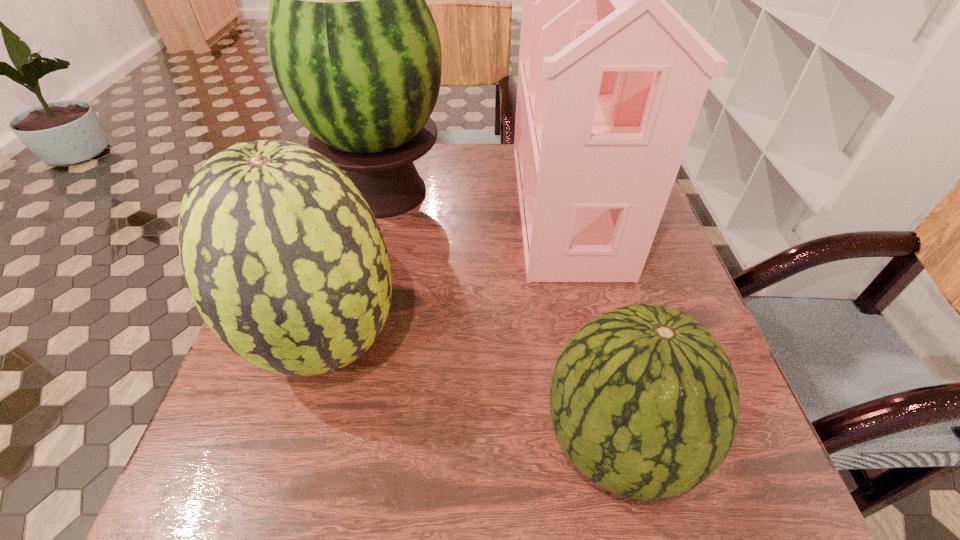
This screenshot has width=960, height=540. I want to click on vacant space located 0.160m on the left of the rightmost watermelon, so click(436, 442).

Where is `dollhouse that is at the far edge`? This screenshot has width=960, height=540. dollhouse that is at the far edge is located at coordinates (609, 90).

This screenshot has height=540, width=960. I want to click on watermelon at the far edge, so click(x=353, y=46).

Image resolution: width=960 pixels, height=540 pixels. Find the location of `object at the near edge`. object at the near edge is located at coordinates click(x=644, y=401).

Where is `dollhouse present at the right edge`? dollhouse present at the right edge is located at coordinates (609, 90).

Find the location of a particular element. The width and height of the screenshot is (960, 540). watermelon that is at the right edge is located at coordinates (644, 401).

Where is `object present at the far left corner`? This screenshot has height=540, width=960. object present at the far left corner is located at coordinates (353, 46).

Where is `object located in the far right corner section of the desktop`? This screenshot has width=960, height=540. object located in the far right corner section of the desktop is located at coordinates (609, 90).

Identify the location of object that is at the near right corner. This screenshot has width=960, height=540. (644, 401).

Identify the location of free space at the far edge. (482, 183).